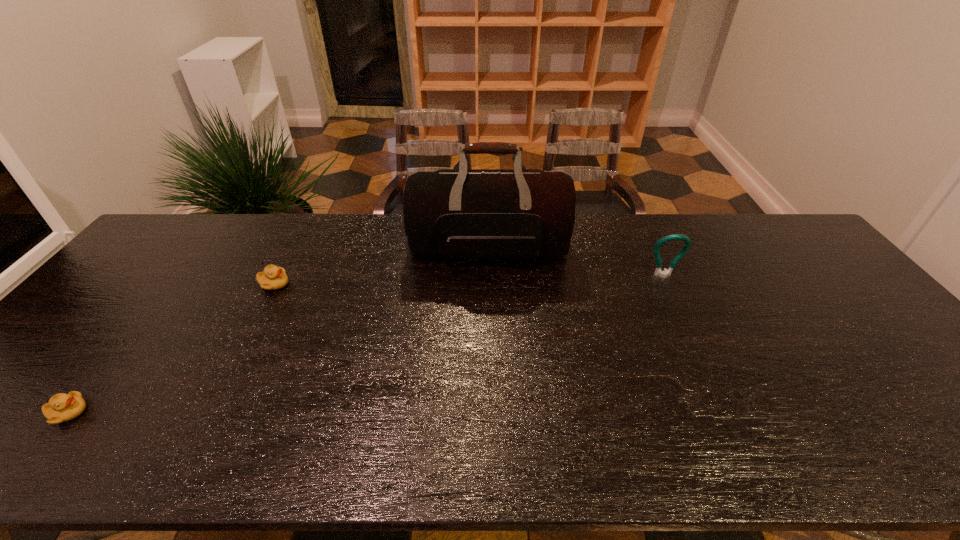
Identify the location of vacant area that lies between the duffel bag and the right duckling. (382, 266).

Point out which object is positioned as the third nearest to the nearest object. Please provide its 2D coordinates. Your answer should be formatted as a tuple, i.e. [(x, y)], where the tuple contains the x and y coordinates of a point satisfying the conditions above.

[(687, 243)]

The image size is (960, 540). I want to click on the closest object to the second object from left to right, so click(487, 214).

Locate an element on the screen. This screenshot has height=540, width=960. vacant area in the image that satisfies the following two spatial constraints: 1. on the front pocket of the tallest object; 2. at the beak of the left duckling is located at coordinates (493, 413).

Locate an element on the screen. The image size is (960, 540). vacant area in the image that satisfies the following two spatial constraints: 1. at the jaws of the rightmost object; 2. on the front-facing side of the right duckling is located at coordinates (667, 284).

Where is `vacant region that satisfies the following two spatial constraints: 1. at the jaws of the rightmost object; 2. on the front-facing side of the right duckling`? The width and height of the screenshot is (960, 540). vacant region that satisfies the following two spatial constraints: 1. at the jaws of the rightmost object; 2. on the front-facing side of the right duckling is located at coordinates [667, 284].

Locate an element on the screen. The width and height of the screenshot is (960, 540). free region that satisfies the following two spatial constraints: 1. at the jaws of the third shortest object; 2. at the beak of the nearer duckling is located at coordinates (728, 413).

Where is `free space that satisfies the following two spatial constraints: 1. at the jaws of the rightmost object; 2. at the beak of the nearer duckling`? The height and width of the screenshot is (540, 960). free space that satisfies the following two spatial constraints: 1. at the jaws of the rightmost object; 2. at the beak of the nearer duckling is located at coordinates (728, 413).

You are a GUI agent. You are given a task and a screenshot of the screen. Output one action in this format:
    pyautogui.click(x=<x>, y=<y>)
    Task: Click on the free space that satisfies the following two spatial constraints: 1. on the front pocket of the tallest object; 2. at the beak of the nearer duckling
    The height and width of the screenshot is (540, 960).
    Given the screenshot: What is the action you would take?
    pyautogui.click(x=493, y=413)

The height and width of the screenshot is (540, 960). I want to click on free space that satisfies the following two spatial constraints: 1. on the front pocket of the duffel bag; 2. on the front-facing side of the second object from left to right, so click(x=491, y=284).